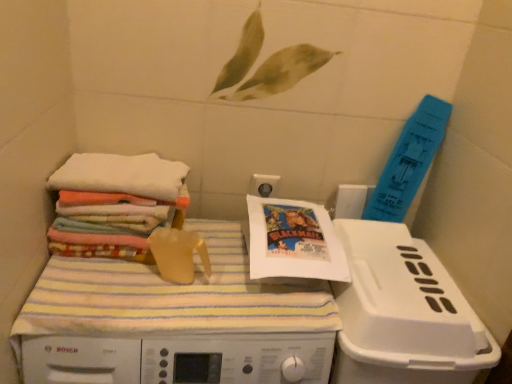
Where is `empty space that is ontop of white soft towels at left (from a real-world perspective)`? The image size is (512, 384). empty space that is ontop of white soft towels at left (from a real-world perspective) is located at coordinates (128, 168).